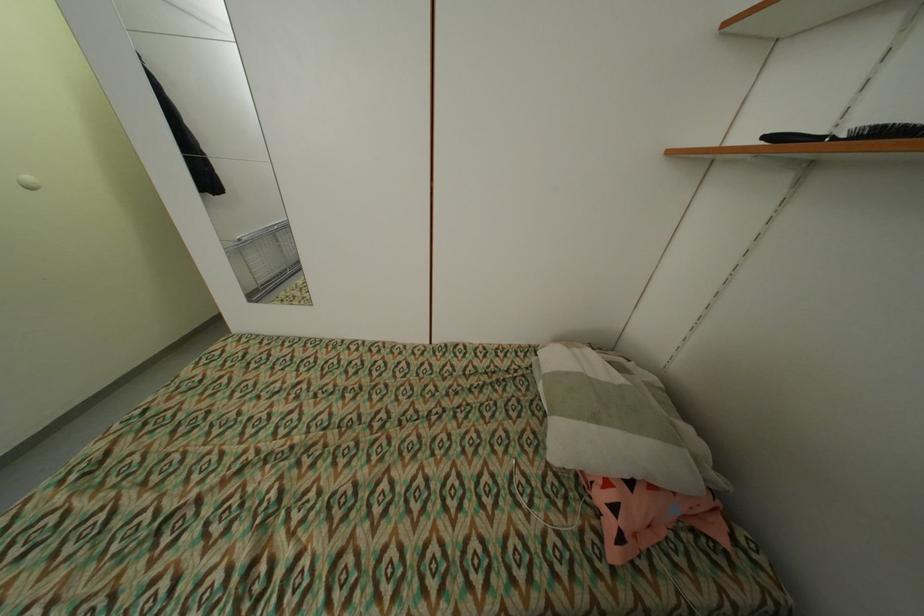
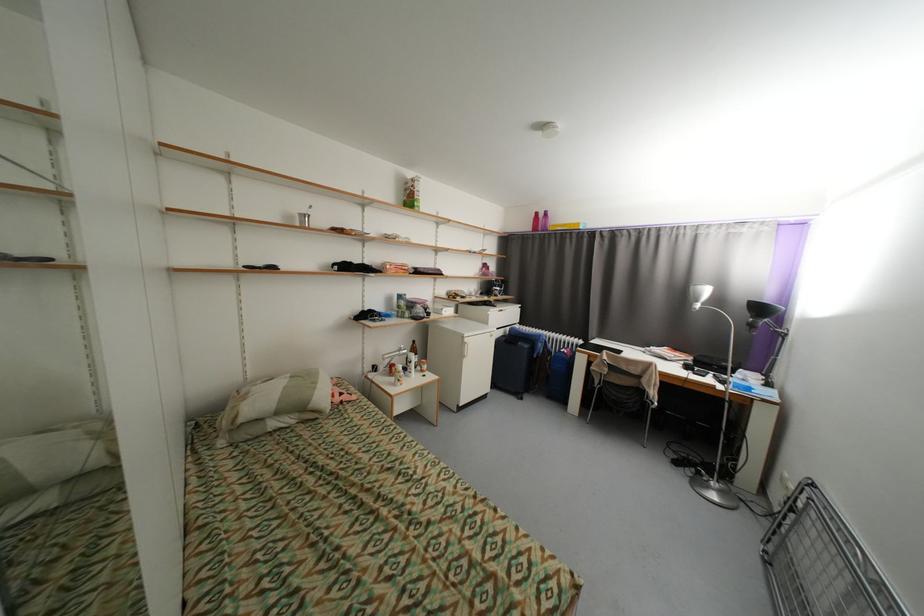
Where in the second image is the point corresponding to point 602,421 from the first image?

(322, 384)